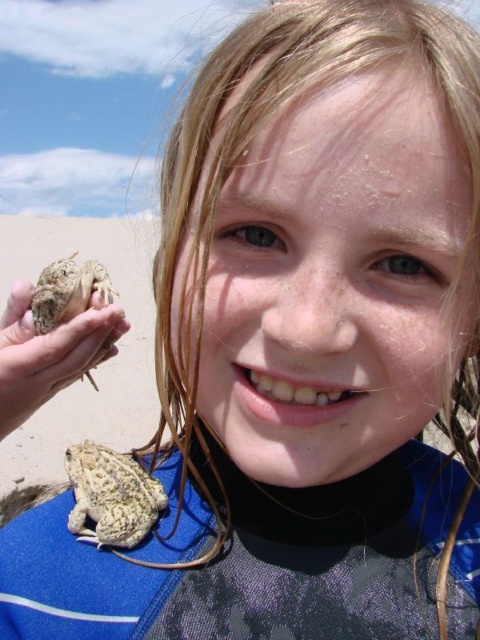
Looking at this image, who is positioned more to the right, smooth beige skin at lower left or speckled brown frog at lower center?

Positioned to the right is speckled brown frog at lower center.

Can you confirm if smooth beige skin at lower left is shorter than speckled brown frog at lower center?

No.

In order to click on smooth beige skin at lower left in this screenshot , I will do `click(48, 353)`.

Locate an element on the screen. This screenshot has width=480, height=640. smooth beige skin at lower left is located at coordinates (48, 353).

Between blue fabric wetsuit at center and smooth beige skin at lower left, which one has more height?

With more height is blue fabric wetsuit at center.

Which is behind, point (122, 582) or point (69, 324)?

The point (69, 324) is more distant.

Image resolution: width=480 pixels, height=640 pixels. In order to click on blue fabric wetsuit at center in this screenshot , I will do point(250,564).

Can you confirm if smooth beige skin at lower left is smaller than brown rough skin frog at lower left?

Correct, smooth beige skin at lower left occupies less space than brown rough skin frog at lower left.

Can you confirm if smooth beige skin at lower left is thinner than brown rough skin frog at lower left?

Correct, smooth beige skin at lower left's width is less than brown rough skin frog at lower left's.

Between point (23, 300) and point (59, 289), which one is positioned in front?

Point (59, 289) is more forward.

Locate an element on the screen. The image size is (480, 640). smooth beige skin at lower left is located at coordinates (48, 353).